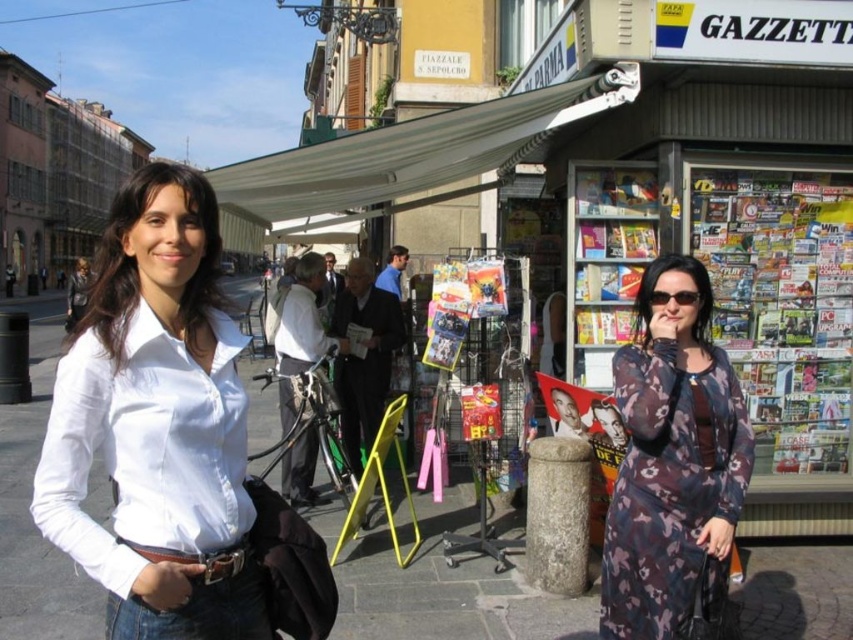
Can you confirm if floral-patterned fabric dress at lower right is wider than matte plastic magazine at center?

Yes.

Who is lower down, floral-patterned fabric dress at lower right or matte plastic magazine at center?

Positioned lower is floral-patterned fabric dress at lower right.

Who is more distant from viewer, (x=695, y=394) or (x=354, y=326)?

The point (x=354, y=326) is behind.

Find the location of `floral-patterned fabric dress at lower right`. floral-patterned fabric dress at lower right is located at coordinates (669, 484).

Based on the photo, is the position of brown leather belt at lower left less distant than that of matte black sunglasses at center?

Yes, it is.

What do you see at coordinates (198, 561) in the screenshot?
I see `brown leather belt at lower left` at bounding box center [198, 561].

Locate an element on the screen. brown leather belt at lower left is located at coordinates (198, 561).

This screenshot has width=853, height=640. I want to click on floral-patterned fabric dress at lower right, so click(669, 484).

Which of these two, floral-patterned fabric dress at lower right or matte black sunglasses at center, stands shorter?

matte black sunglasses at center is shorter.

Who is more forward, (683, 458) or (685, 292)?

Point (683, 458) is in front.

Image resolution: width=853 pixels, height=640 pixels. I want to click on floral-patterned fabric dress at lower right, so click(x=669, y=484).